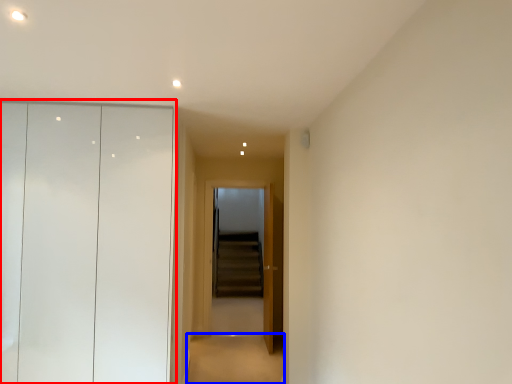
Question: Which object appears farthest to the camera in this image, dresser (highlighted by a red box) or path (highlighted by a blue box)?

Choices:
 (A) dresser
 (B) path

Answer: (B)